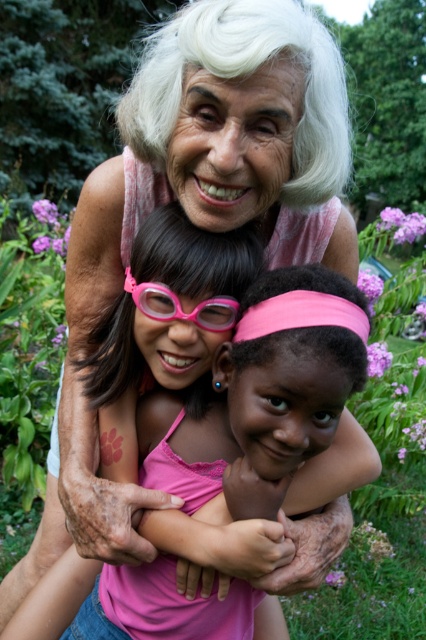
Question: Can you confirm if pink fabric at center is positioned to the left of pink rubber goggles at center?

Choices:
 (A) no
 (B) yes

Answer: (A)

Question: Can you confirm if pink fabric at center is smaller than pink rubber goggles at center?

Choices:
 (A) no
 (B) yes

Answer: (A)

Question: Which object is farther from the camera taking this photo?

Choices:
 (A) pink rubber goggles at center
 (B) pink fabric at center

Answer: (A)

Question: Which object appears closest to the camera in this image?

Choices:
 (A) pink fabric at center
 (B) pink rubber goggles at center

Answer: (A)

Question: Can you confirm if pink fabric at center is positioned to the right of pink rubber goggles at center?

Choices:
 (A) yes
 (B) no

Answer: (A)

Question: Which object is closer to the camera taking this photo?

Choices:
 (A) pink fabric at center
 (B) pink rubber goggles at center

Answer: (A)